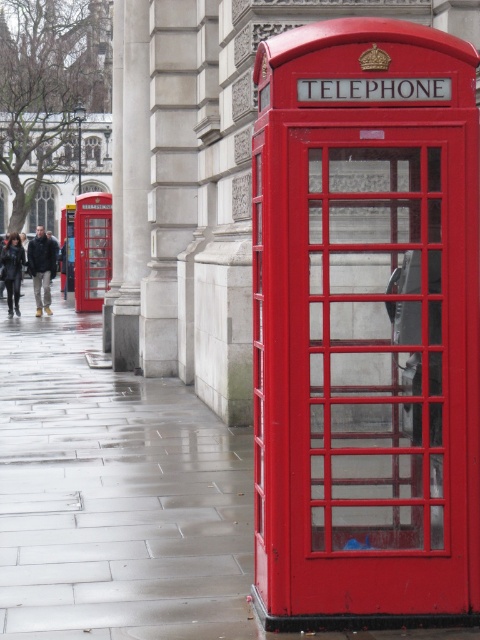
You are a delivery person trying to place a large package on the ground near the dark brown leather jacket at left. Can you place it on the glossy concrete pavement at lower left without overlapping the jacket?

The glossy concrete pavement at lower left is larger in size than the dark brown leather jacket at left, so yes, you can place the package there without overlapping the jacket.

You are a delivery person needing to pass through the narrowest space between the sanded stone column at center and the black leather jacket at left. Can you determine which side you should choose to navigate through?

The sanded stone column at center has a lesser width compared to the black leather jacket at left, so you should choose the side of the sanded stone column at center to navigate through as it is narrower.